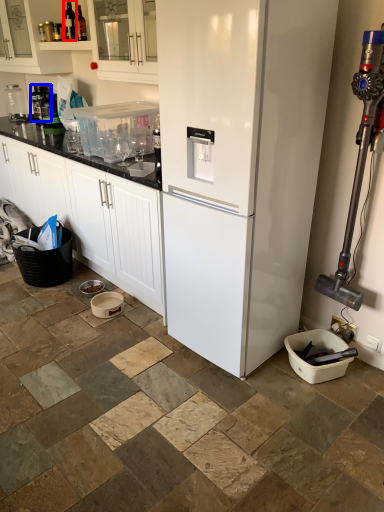
Question: Which point is closer to the camera, bottle (highlighted by a red box) or appliance (highlighted by a blue box)?

Choices:
 (A) bottle
 (B) appliance

Answer: (A)